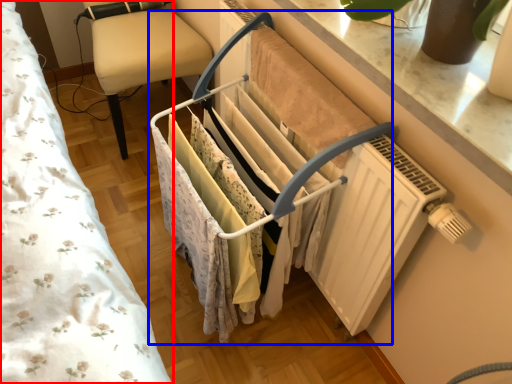
Question: Which object is closer to the camera taking this photo, bed (highlighted by a red box) or closet (highlighted by a blue box)?

Choices:
 (A) bed
 (B) closet

Answer: (A)